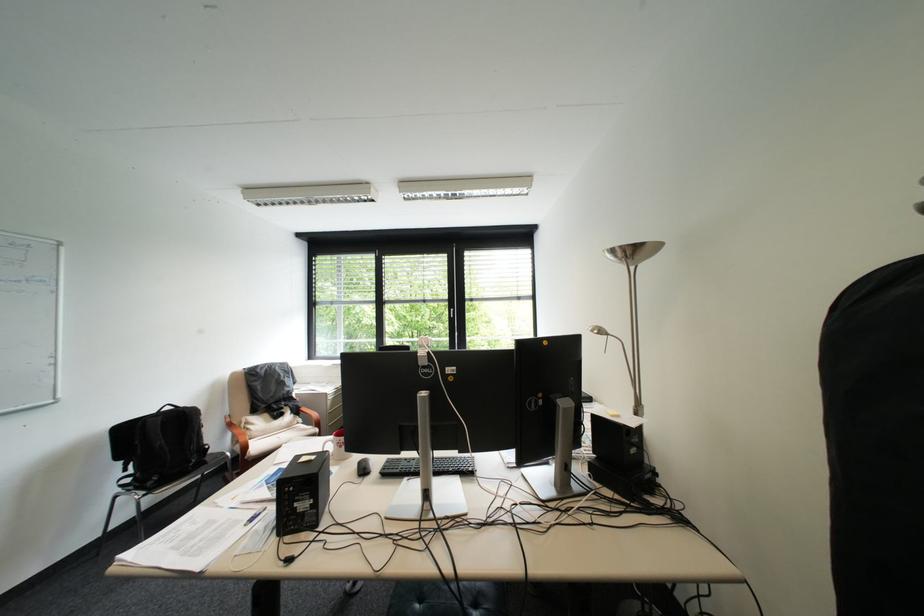
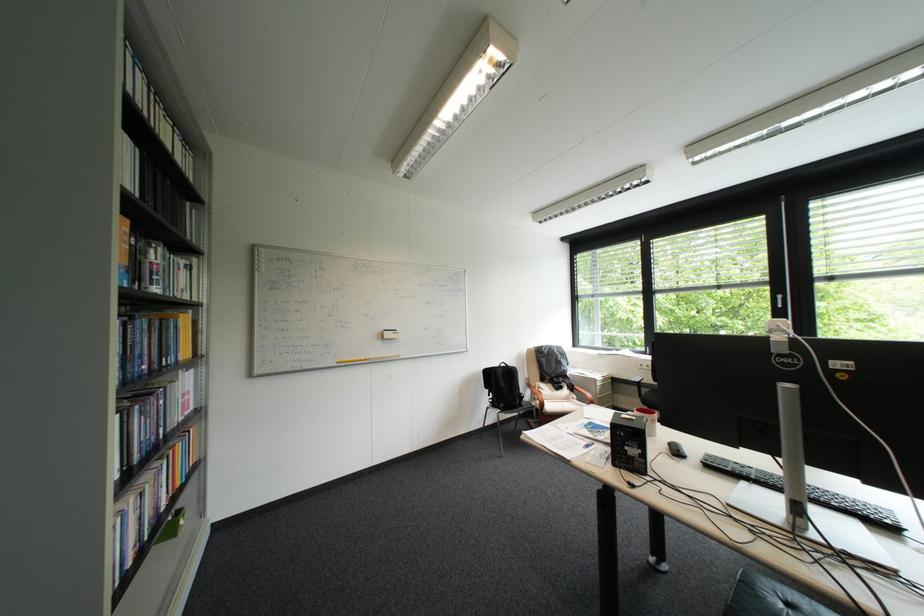
In the second image, find the point that corresponds to (371,464) in the first image.

(682, 445)